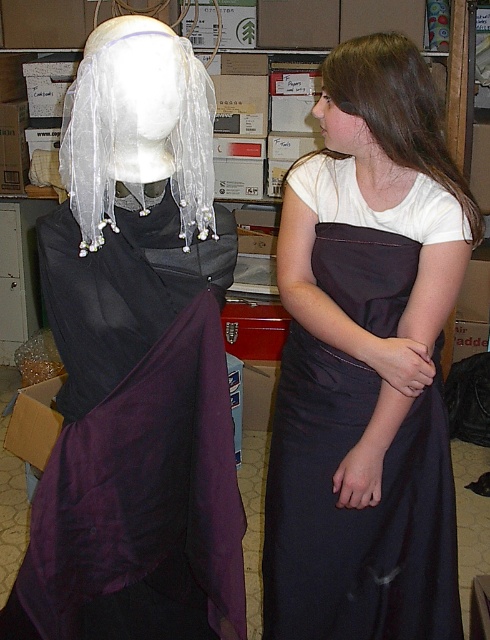
Consider the image. You are standing in the storage area and want to move from point A to point B. Point A is at coordinate point(434, 99) and point B is at coordinate point(443, 177). According to the scene description, which point is closer to you?

Point(434, 99) is in front of point(443, 177), so point A is closer to you.

You are a person with a height of 1.7 meters standing in the storage area. You want to reach the brown silky hair at upper right. The ceiling height is 2.5 meters. Can you safely reach it without climbing?

The brown silky hair at upper right is 1.24 meters away from you. Since the ceiling is 2.5 meters high and you are 1.7 meters tall, you can safely reach it without climbing as the distance is within your arm reach and height limit.